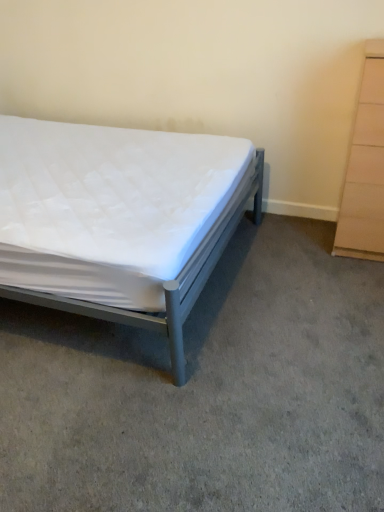
Image resolution: width=384 pixels, height=512 pixels. Find the location of `blank space above white quilted mattress at center (from a real-world perspective)`. blank space above white quilted mattress at center (from a real-world perspective) is located at coordinates (198, 347).